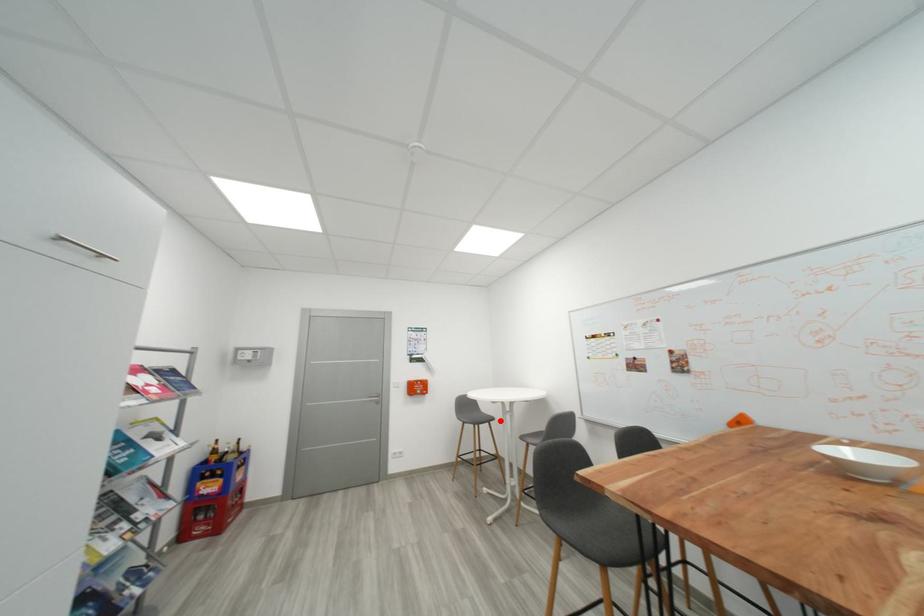
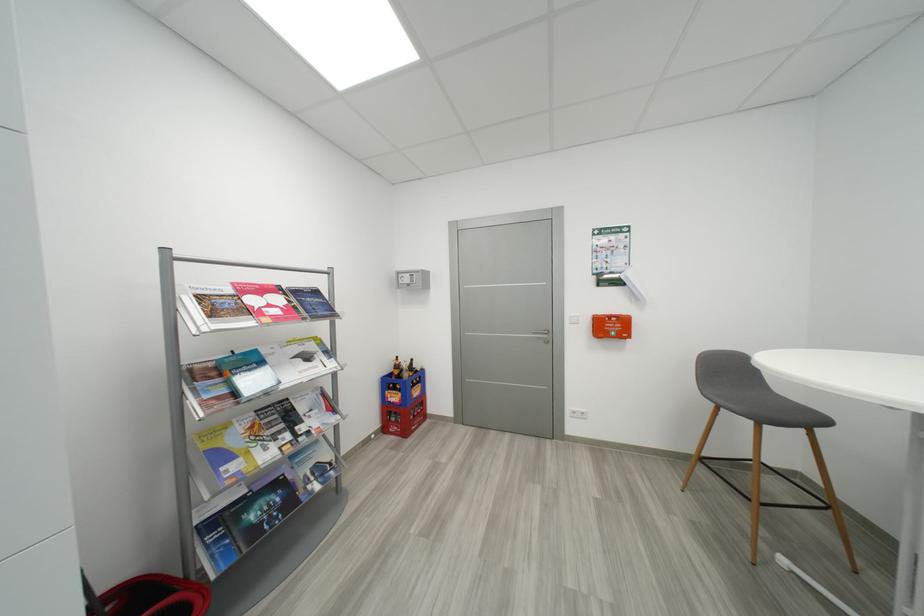
Locate, in the second image, the point that corresponds to the highlighted location in the first image.

(833, 424)